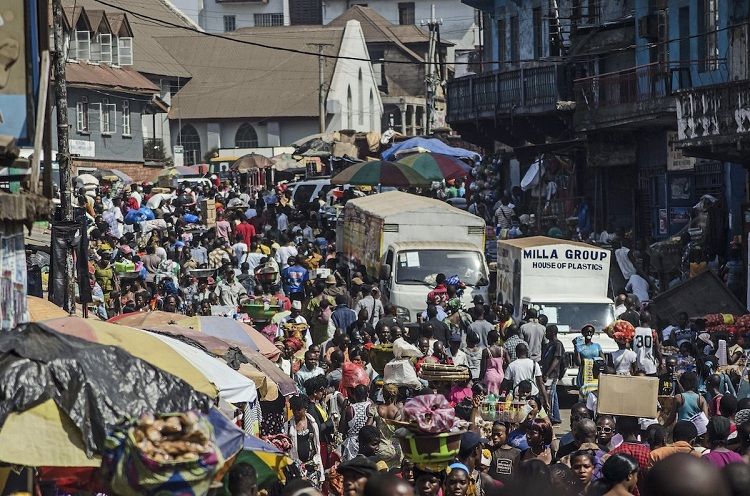
Where is `basket`? This screenshot has width=750, height=496. basket is located at coordinates (434, 443).